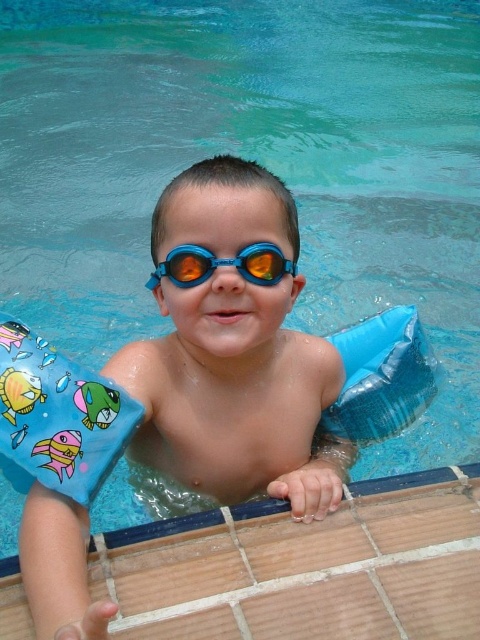
The child is holding two items in the pool. Which one is positioned to the right of the other? The blue rubber arm float at center or the blue rubber goggles at center?

The blue rubber arm float at center is positioned to the right of the blue rubber goggles at center.

You are standing at the edge of the pool and see the blue rubber arm float at center. If you want to grab it, will you be able to reach it without moving your feet?

The blue rubber arm float at center and viewer are 5.63 feet apart from each other, so you cannot reach it without moving your feet since the distance is too far.

Where is the blue rubber arm float at center located in the image?

The blue rubber arm float at center is located at point (236, 396) in the image.